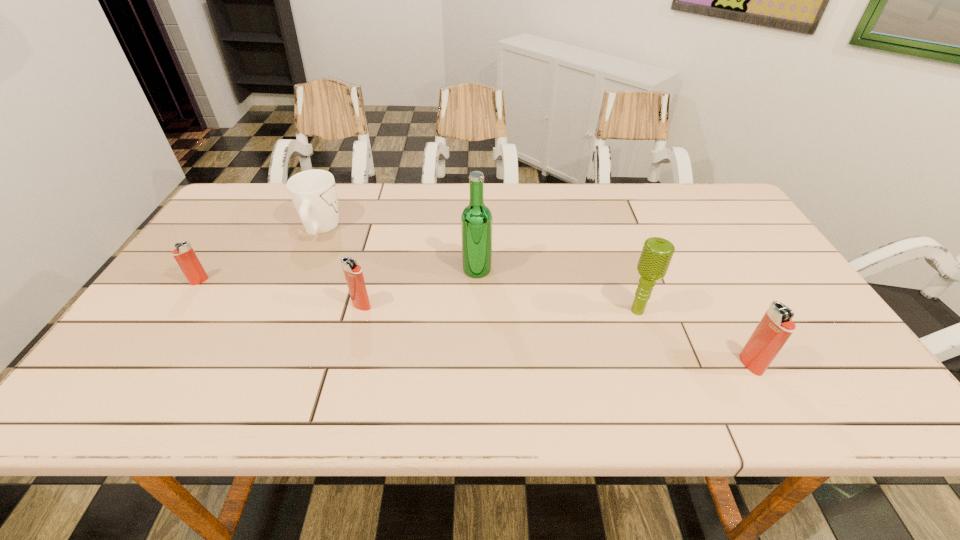
I want to click on vacant space in between the second object from right to left and the third object from right to left, so click(x=558, y=291).

Find the location of a particular element. The image size is (960, 540). free area in between the nearest igniter and the beer bottle is located at coordinates (613, 317).

At what (x,y) coordinates should I click in order to perform the action: click on free space that is in between the nearest object and the leftmost igniter. Please return your answer as a coordinate pair (x, y). The height and width of the screenshot is (540, 960). Looking at the image, I should click on (475, 323).

Image resolution: width=960 pixels, height=540 pixels. I want to click on vacant point located between the mug and the beer bottle, so click(399, 249).

Find the location of a particular element. Image resolution: width=960 pixels, height=540 pixels. vacant area that lies between the third object from right to left and the farthest igniter is located at coordinates (338, 275).

Find the location of a particular element. This screenshot has height=540, width=960. free space between the farthest igniter and the fifth object from right to left is located at coordinates (260, 255).

Identify which object is the third nearest to the second tallest igniter. Please provide its 2D coordinates. Your answer should be formatted as a tuple, i.e. [(x, y)], where the tuple contains the x and y coordinates of a point satisfying the conditions above.

[(184, 254)]

Identify which object is the fourth nearest to the second nearest igniter. Please provide its 2D coordinates. Your answer should be formatted as a tuple, i.e. [(x, y)], where the tuple contains the x and y coordinates of a point satisfying the conditions above.

[(656, 255)]

Locate an element on the screen. igniter that stands as the third closest to the mug is located at coordinates (776, 326).

Where is `igniter that is the second closest to the second tallest object`? Image resolution: width=960 pixels, height=540 pixels. igniter that is the second closest to the second tallest object is located at coordinates (353, 273).